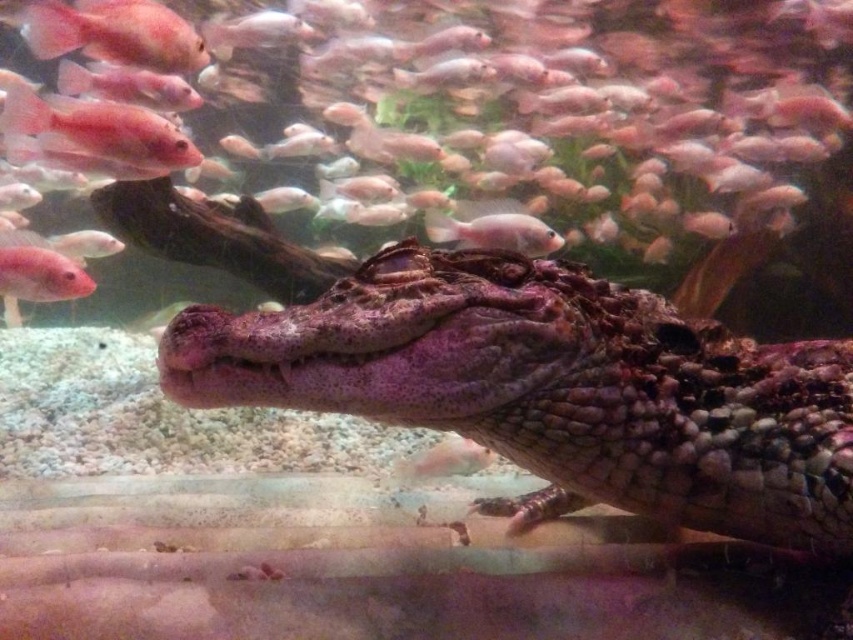
Question: Considering the relative positions of pink glossy fish at upper left and pink glossy fish at center in the image provided, where is pink glossy fish at upper left located with respect to pink glossy fish at center?

Choices:
 (A) right
 (B) left

Answer: (B)

Question: Which of these objects is positioned farthest from the pink glossy fish at upper left?

Choices:
 (A) pink matte fish at left
 (B) purple scaly crocodile at center

Answer: (B)

Question: Does pink matte fish at upper center have a larger size compared to purple scaly crocodile at center?

Choices:
 (A) yes
 (B) no

Answer: (A)

Question: Which object appears closest to the camera in this image?

Choices:
 (A) pink glossy fish at upper left
 (B) pink matte fish at upper center
 (C) pink matte fish at left
 (D) pink glossy fish at center

Answer: (A)

Question: Considering the real-world distances, which object is farthest from the pink matte fish at upper center?

Choices:
 (A) pink glossy fish at center
 (B) pink matte fish at left
 (C) purple scaly crocodile at center
 (D) pink glossy fish at upper left

Answer: (C)

Question: Can you confirm if purple scaly crocodile at center is smaller than pink glossy fish at center?

Choices:
 (A) yes
 (B) no

Answer: (B)